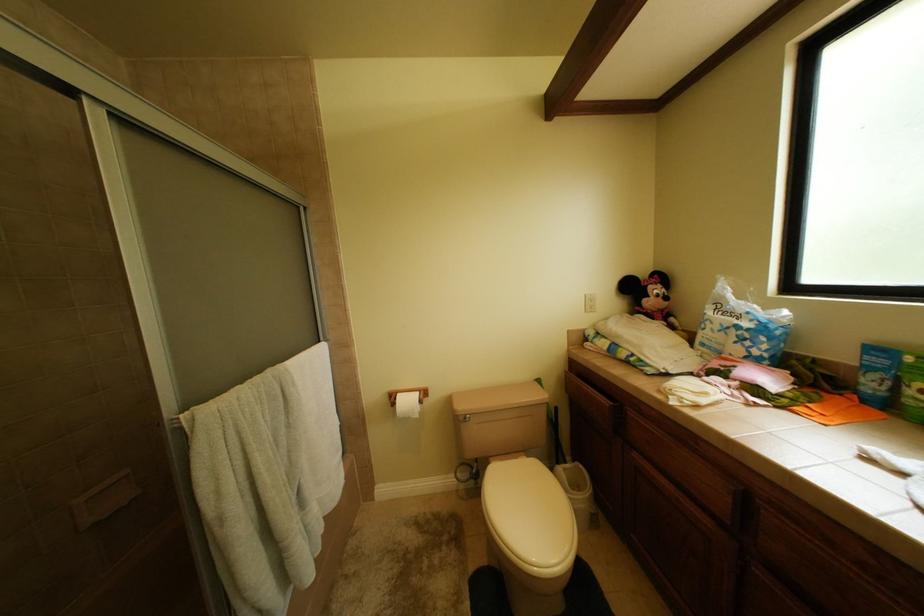
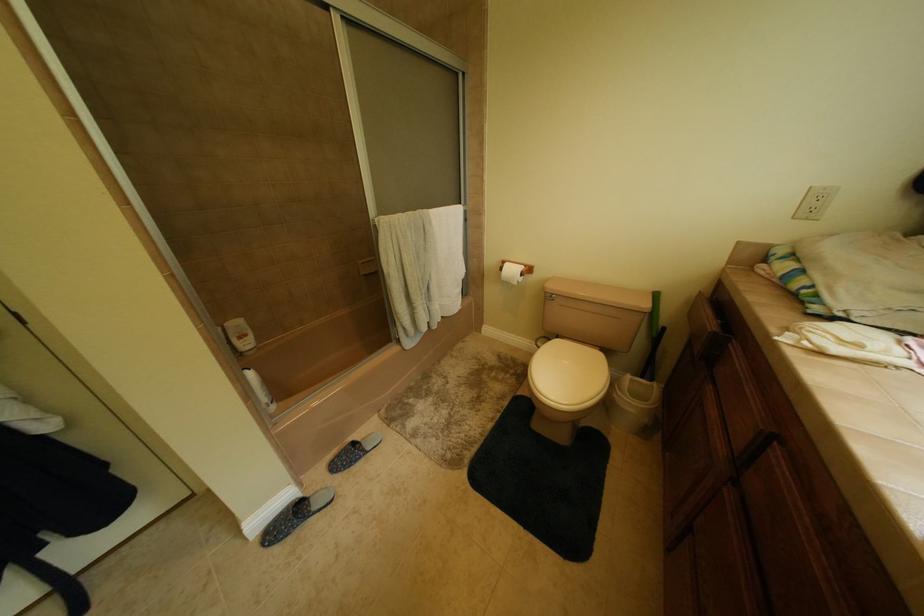
First-person continuous shooting, in which direction is the camera rotating?

The camera rotated toward left-down.